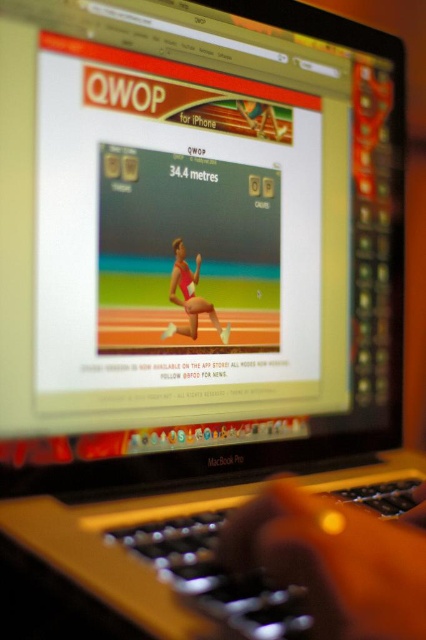
Can you confirm if black plastic keyboard at lower center is shorter than matte pink swimsuit at center?

Indeed, black plastic keyboard at lower center has a lesser height compared to matte pink swimsuit at center.

Does black plastic keyboard at lower center appear over matte pink swimsuit at center?

Actually, black plastic keyboard at lower center is below matte pink swimsuit at center.

Between point (245, 605) and point (192, 310), which one is positioned behind?

Point (192, 310)

The image size is (426, 640). In order to click on black plastic keyboard at lower center in this screenshot , I will do `click(215, 577)`.